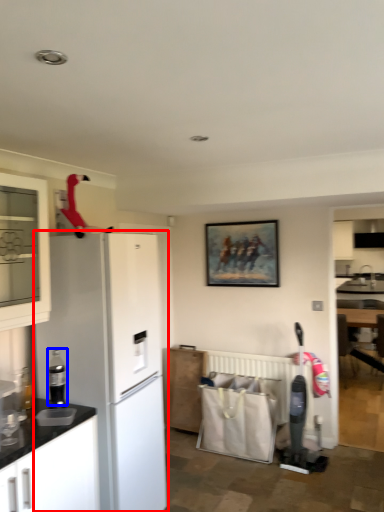
Question: Among these objects, which one is nearest to the camera, refrigerator (highlighted by a red box) or appliance (highlighted by a blue box)?

Choices:
 (A) refrigerator
 (B) appliance

Answer: (B)